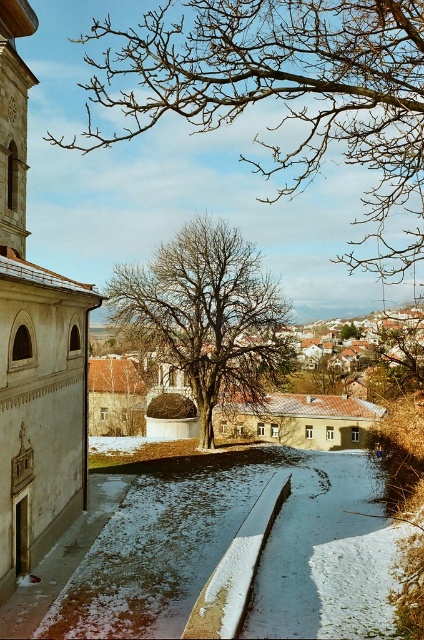
Question: Which point is closer to the camera taking this photo?

Choices:
 (A) (5, 109)
 (B) (357, 337)

Answer: (A)

Question: Which of the following is the closest to the observer?

Choices:
 (A) brown leafless tree at center
 (B) bare branches at center
 (C) white stone tower at left
 (D) bare branches at upper center

Answer: (D)

Question: Can you confirm if bare branches at center is positioned to the right of brown leafless tree at center?

Choices:
 (A) no
 (B) yes

Answer: (A)

Question: Is bare branches at upper center to the left of brown leafless tree at center from the viewer's perspective?

Choices:
 (A) no
 (B) yes

Answer: (B)

Question: Can you confirm if bare branches at upper center is positioned above brown leafless tree at center?

Choices:
 (A) yes
 (B) no

Answer: (A)

Question: Considering the real-world distances, which object is farthest from the bare branches at upper center?

Choices:
 (A) brown leafless tree at center
 (B) white stone tower at left
 (C) bare branches at center

Answer: (A)